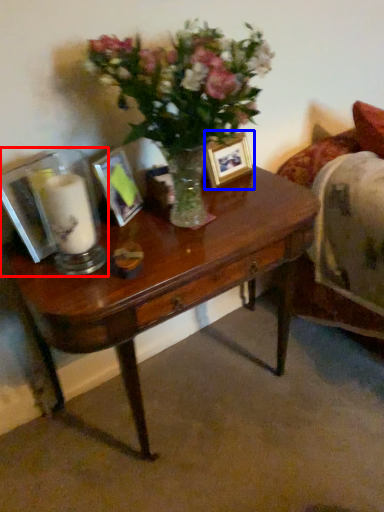
Question: Which point is closer to the camera, tableware (highlighted by a red box) or picture frame (highlighted by a blue box)?

Choices:
 (A) tableware
 (B) picture frame

Answer: (A)